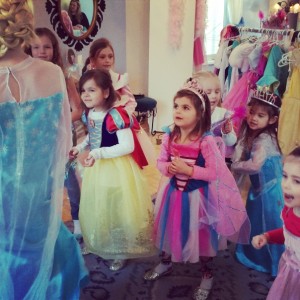
Where is `cream wall`? This screenshot has width=300, height=300. cream wall is located at coordinates (157, 31).